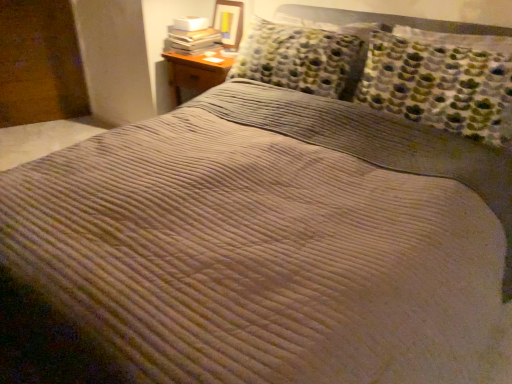
Question: Is matte wooden picture frame at upper center wider or thinner than white paper stack at upper left?

Choices:
 (A) thin
 (B) wide

Answer: (A)

Question: From a real-world perspective, is matte wooden picture frame at upper center positioned above or below white paper stack at upper left?

Choices:
 (A) above
 (B) below

Answer: (A)

Question: From the image's perspective, is matte wooden picture frame at upper center positioned above or below white paper stack at upper left?

Choices:
 (A) below
 (B) above

Answer: (B)

Question: Does point (174, 23) appear closer or farther from the camera than point (239, 4)?

Choices:
 (A) closer
 (B) farther

Answer: (A)

Question: Considering the positions of white paper stack at upper left and matte wooden picture frame at upper center in the image, is white paper stack at upper left wider or thinner than matte wooden picture frame at upper center?

Choices:
 (A) wide
 (B) thin

Answer: (A)

Question: Is white paper stack at upper left bigger or smaller than matte wooden picture frame at upper center?

Choices:
 (A) small
 (B) big

Answer: (B)

Question: From their relative heights in the image, would you say white paper stack at upper left is taller or shorter than matte wooden picture frame at upper center?

Choices:
 (A) tall
 (B) short

Answer: (B)